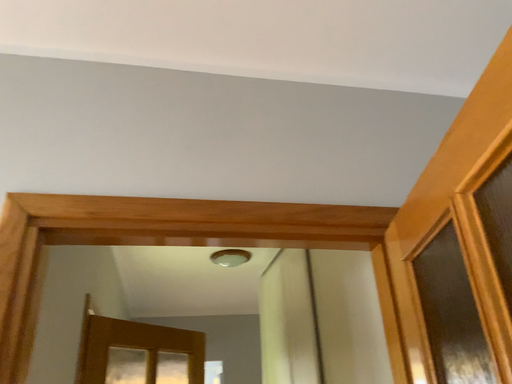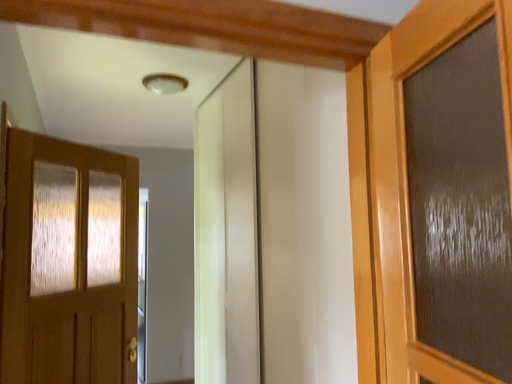
Question: Which way did the camera rotate in the video?

Choices:
 (A) rotated right
 (B) rotated left

Answer: (A)